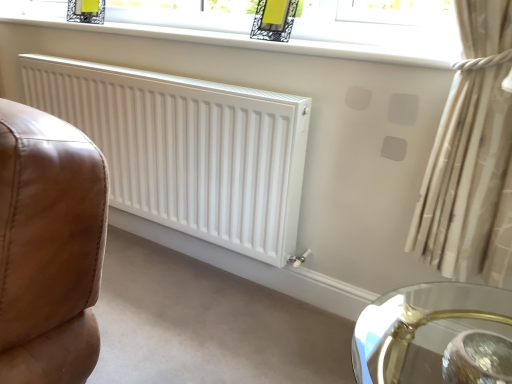
Question: Does clear glass window at upper center have a lesser width compared to beige fabric curtain at right?

Choices:
 (A) no
 (B) yes

Answer: (A)

Question: Does clear glass window at upper center have a greater height compared to beige fabric curtain at right?

Choices:
 (A) no
 (B) yes

Answer: (A)

Question: Is clear glass window at upper center turned away from beige fabric curtain at right?

Choices:
 (A) no
 (B) yes

Answer: (A)

Question: Considering the relative sizes of clear glass window at upper center and beige fabric curtain at right in the image provided, is clear glass window at upper center shorter than beige fabric curtain at right?

Choices:
 (A) yes
 (B) no

Answer: (A)

Question: Is clear glass window at upper center at the right side of beige fabric curtain at right?

Choices:
 (A) no
 (B) yes

Answer: (A)

Question: In terms of width, does beige fabric curtain at right look wider or thinner when compared to white matte radiator at center?

Choices:
 (A) wide
 (B) thin

Answer: (A)

Question: Considering their positions, is beige fabric curtain at right located in front of or behind white matte radiator at center?

Choices:
 (A) behind
 (B) front

Answer: (B)

Question: Which is correct: beige fabric curtain at right is inside white matte radiator at center, or outside of it?

Choices:
 (A) outside
 (B) inside

Answer: (A)

Question: Visually, is beige fabric curtain at right positioned to the left or to the right of white matte radiator at center?

Choices:
 (A) right
 (B) left

Answer: (A)

Question: Is clear glass window at upper center spatially inside beige fabric curtain at right, or outside of it?

Choices:
 (A) inside
 (B) outside

Answer: (B)

Question: Is clear glass window at upper center wider or thinner than beige fabric curtain at right?

Choices:
 (A) thin
 (B) wide

Answer: (B)

Question: In the image, is clear glass window at upper center positioned in front of or behind beige fabric curtain at right?

Choices:
 (A) behind
 (B) front

Answer: (A)

Question: Looking at the image, does clear glass window at upper center seem bigger or smaller compared to beige fabric curtain at right?

Choices:
 (A) big
 (B) small

Answer: (B)

Question: Considering the relative positions of white matte radiator at center and beige fabric curtain at right in the image provided, is white matte radiator at center to the left or to the right of beige fabric curtain at right?

Choices:
 (A) right
 (B) left

Answer: (B)

Question: In terms of width, does white matte radiator at center look wider or thinner when compared to beige fabric curtain at right?

Choices:
 (A) thin
 (B) wide

Answer: (A)